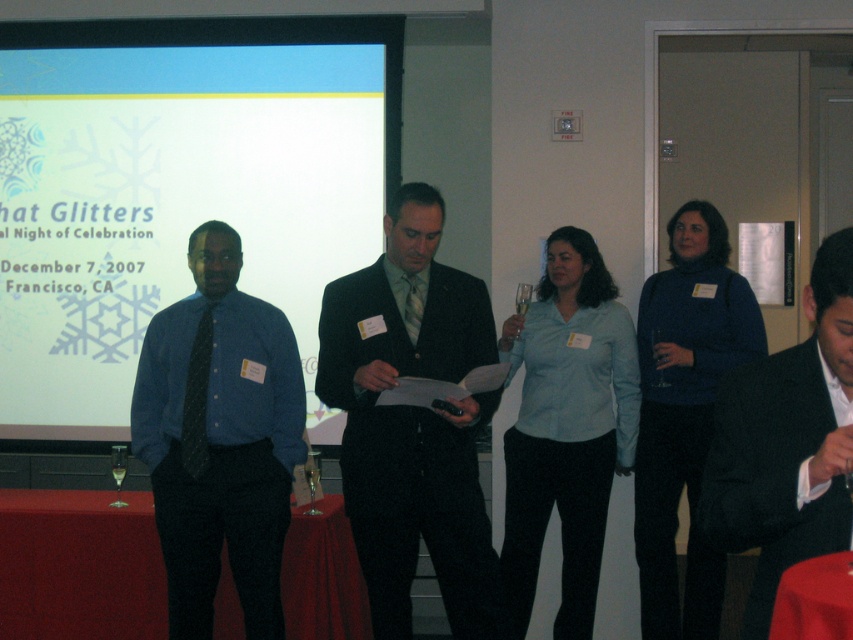
Is point (15, 93) more distant than point (461, 332)?

Yes, it is behind point (461, 332).

Measure the distance between white paper at upper left and camera.

white paper at upper left is 12.69 feet from camera.

Where is `white paper at upper left`? Image resolution: width=853 pixels, height=640 pixels. white paper at upper left is located at coordinates (177, 192).

Which is more to the right, light blue shirt at center or red fabric table at lower left?

light blue shirt at center

Who is positioned more to the left, light blue shirt at center or red fabric table at lower left?

From the viewer's perspective, red fabric table at lower left appears more on the left side.

Which is in front, point (548, 320) or point (73, 588)?

Point (73, 588)

Image resolution: width=853 pixels, height=640 pixels. I want to click on light blue shirt at center, so click(x=566, y=428).

The width and height of the screenshot is (853, 640). Find the location of `white paper at upper left`. white paper at upper left is located at coordinates [177, 192].

Is white paper at upper left smaller than black suit at center?

Actually, white paper at upper left might be larger than black suit at center.

Between point (294, 33) and point (737, 429), which one is positioned behind?

Positioned behind is point (294, 33).

Find the location of a particular element. The height and width of the screenshot is (640, 853). white paper at upper left is located at coordinates tap(177, 192).